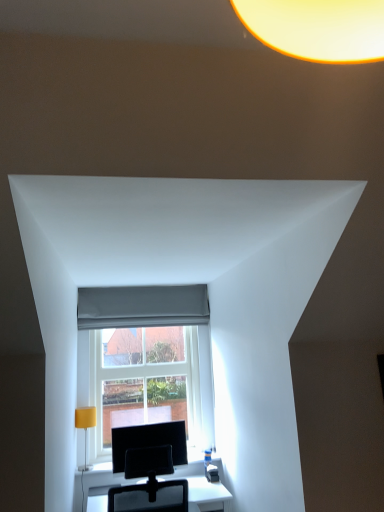
Question: Is clear glass window at center closer to the viewer compared to gray fabric curtain at center?

Choices:
 (A) yes
 (B) no

Answer: (A)

Question: From the image's perspective, is clear glass window at center on gray fabric curtain at center?

Choices:
 (A) yes
 (B) no

Answer: (B)

Question: Considering the relative sizes of clear glass window at center and gray fabric curtain at center in the image provided, is clear glass window at center thinner than gray fabric curtain at center?

Choices:
 (A) no
 (B) yes

Answer: (A)

Question: Can you confirm if clear glass window at center is positioned to the left of gray fabric curtain at center?

Choices:
 (A) yes
 (B) no

Answer: (B)

Question: Is gray fabric curtain at center at the back of clear glass window at center?

Choices:
 (A) no
 (B) yes

Answer: (A)

Question: Is white glossy table at center to the left or to the right of yellow fabric lampshade at left in the image?

Choices:
 (A) right
 (B) left

Answer: (A)

Question: Looking at their shapes, would you say white glossy table at center is wider or thinner than yellow fabric lampshade at left?

Choices:
 (A) thin
 (B) wide

Answer: (B)

Question: From a real-world perspective, is white glossy table at center physically located above or below yellow fabric lampshade at left?

Choices:
 (A) above
 (B) below

Answer: (B)

Question: Considering the positions of white glossy table at center and yellow fabric lampshade at left in the image, is white glossy table at center bigger or smaller than yellow fabric lampshade at left?

Choices:
 (A) small
 (B) big

Answer: (B)

Question: From a real-world perspective, is yellow fabric lampshade at left physically located above or below clear glass window at center?

Choices:
 (A) below
 (B) above

Answer: (A)

Question: Is yellow fabric lampshade at left inside or outside of clear glass window at center?

Choices:
 (A) inside
 (B) outside

Answer: (B)

Question: In terms of height, does yellow fabric lampshade at left look taller or shorter compared to clear glass window at center?

Choices:
 (A) short
 (B) tall

Answer: (A)

Question: From the image's perspective, is yellow fabric lampshade at left above or below clear glass window at center?

Choices:
 (A) above
 (B) below

Answer: (B)

Question: Considering the positions of gray fabric curtain at center and white glossy table at center in the image, is gray fabric curtain at center wider or thinner than white glossy table at center?

Choices:
 (A) thin
 (B) wide

Answer: (A)

Question: From a real-world perspective, is gray fabric curtain at center positioned above or below white glossy table at center?

Choices:
 (A) below
 (B) above

Answer: (B)